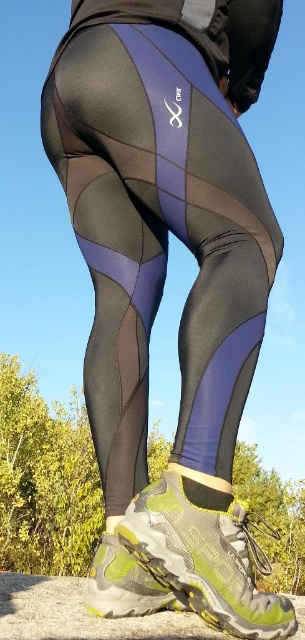
You are a photographer setting up a shoot for a fitness apparel catalog. You need to ensure that the matte black leggings at center and the green mesh running shoe at lower center are both visible in the frame. Given their sizes, which item might require more careful positioning to avoid being cropped out?

The matte black leggings at center has a larger width than the green mesh running shoe at lower center, so it might require more careful positioning to avoid being cropped out due to its greater size.

You are a photographer adjusting your camera to focus on the matte black leggings at center. The camera has a fixed focus point at coordinate point 0.375, 0.525. Will the focus point align with the leggings?

Yes, the focus point at coordinate point (160, 240) will align with the matte black leggings at center because their 2D location is exactly at that point.

From the picture: You are a photographer setting up a shot of the person wearing the leggings and hiking shoes. You need to ensure that the focus is sharp at the point marked at coordinate point (126, 145). If your camera has a depth of field that can sharply focus objects within 1 meter to 1.3 meters from the lens, will the point be in focus?

The distance of point (126, 145) from the camera is 1.17 meters, which falls within the depth of field range of 1 meter to 1.3 meters. Therefore, the point will be in focus.